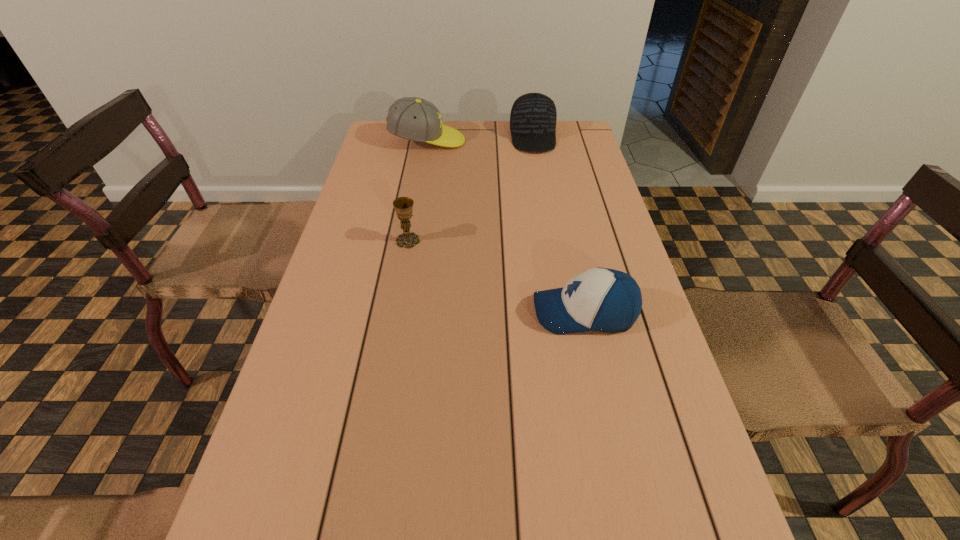
The height and width of the screenshot is (540, 960). Identify the location of chalice that is at the left edge. (403, 206).

Find the location of a particular element. object that is positioned at the far left corner is located at coordinates (412, 118).

You are a GUI agent. You are given a task and a screenshot of the screen. Output one action in this format:
    pyautogui.click(x=<x>, y=<y>)
    Task: Click on the object that is at the far right corner
    This screenshot has height=540, width=960.
    Given the screenshot: What is the action you would take?
    pyautogui.click(x=533, y=116)

Locate an element on the screen. This screenshot has height=540, width=960. free space at the far edge of the desktop is located at coordinates (417, 151).

Image resolution: width=960 pixels, height=540 pixels. In order to click on vacant space at the left edge of the desktop in this screenshot , I will do `click(378, 203)`.

In order to click on free space at the right edge of the desktop in this screenshot , I will do 702,463.

What are the coordinates of `empty space between the nearest baseball cap and the leftmost baseball cap` in the screenshot? It's located at (506, 227).

At what (x,y) coordinates should I click in order to perform the action: click on free space between the leftmost baseball cap and the shortest baseball cap. Please return your answer as a coordinate pair (x, y). Looking at the image, I should click on (506, 227).

Locate an element on the screen. free point between the nearest object and the leftmost baseball cap is located at coordinates (506, 227).

Locate an element on the screen. This screenshot has width=960, height=540. free area in between the nearest baseball cap and the chalice is located at coordinates (496, 276).